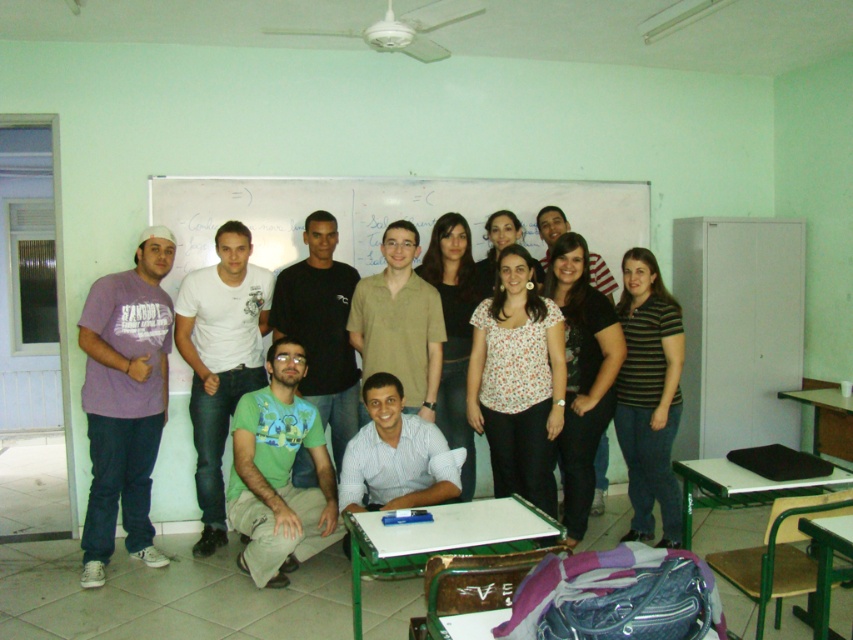
Is purple cotton t-shirt at left wider than white cotton shirt at left?

In fact, purple cotton t-shirt at left might be narrower than white cotton shirt at left.

Is purple cotton t-shirt at left below white cotton shirt at left?

Yes, purple cotton t-shirt at left is below white cotton shirt at left.

Who is more distant from viewer, (109,304) or (207,305)?

The point (207,305) is behind.

Image resolution: width=853 pixels, height=640 pixels. Find the location of `purple cotton t-shirt at left`. purple cotton t-shirt at left is located at coordinates (125, 401).

Who is higher up, green matte shirt at center or white cotton shirt at left?

white cotton shirt at left

Is point (285, 449) less distant than point (231, 305)?

Yes, point (285, 449) is in front of point (231, 305).

Image resolution: width=853 pixels, height=640 pixels. I want to click on green matte shirt at center, so click(x=279, y=474).

How far apart are purple cotton t-shirt at left and striped cotton shirt at right?

The distance of purple cotton t-shirt at left from striped cotton shirt at right is 2.21 meters.

Does point (122, 474) come farther from viewer compared to point (646, 518)?

That is False.

The height and width of the screenshot is (640, 853). I want to click on purple cotton t-shirt at left, so tap(125, 401).